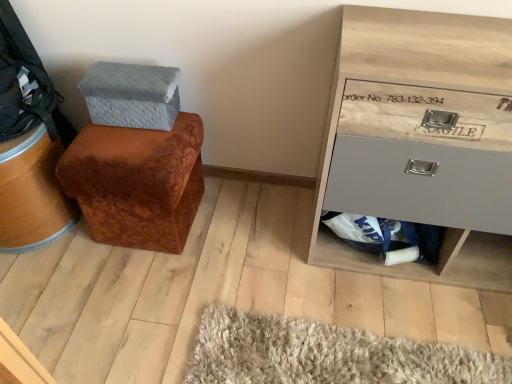
Find the location of a particular element. vacant space in front of textured gray shoe box at upper left is located at coordinates (127, 146).